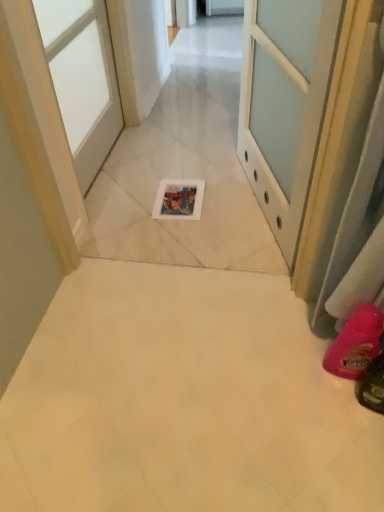
Question: From the image's perspective, is white glossy door at upper center, which appears as the 2th door when viewed from the left, beneath pink rubber boot at lower right?

Choices:
 (A) yes
 (B) no

Answer: (B)

Question: Is the position of white glossy door at upper center, placed as the first door when sorted from right to left, less distant than that of pink rubber boot at lower right?

Choices:
 (A) yes
 (B) no

Answer: (A)

Question: From a real-world perspective, is white glossy door at upper center, placed as the first door when sorted from right to left, located higher than pink rubber boot at lower right?

Choices:
 (A) yes
 (B) no

Answer: (A)

Question: Would you say pink rubber boot at lower right is part of white glossy door at upper center, which appears as the 2th door when viewed from the left,'s contents?

Choices:
 (A) yes
 (B) no

Answer: (B)

Question: Does white glossy door at upper center, which appears as the 2th door when viewed from the left, have a lesser width compared to pink rubber boot at lower right?

Choices:
 (A) yes
 (B) no

Answer: (A)

Question: Is white glossy door at upper center, placed as the first door when sorted from right to left, positioned with its back to pink rubber boot at lower right?

Choices:
 (A) yes
 (B) no

Answer: (B)

Question: Is white glossy door at upper center, which appears as the 2th door when viewed from the left, positioned before white glossy door at upper left, acting as the 1th door starting from the left?

Choices:
 (A) yes
 (B) no

Answer: (A)

Question: Can you confirm if white glossy door at upper center, which appears as the 2th door when viewed from the left, is taller than white glossy door at upper left, the second door from the right?

Choices:
 (A) no
 (B) yes

Answer: (B)

Question: Considering the relative sizes of white glossy door at upper center, placed as the first door when sorted from right to left, and white glossy door at upper left, acting as the 1th door starting from the left, in the image provided, is white glossy door at upper center, placed as the first door when sorted from right to left, thinner than white glossy door at upper left, acting as the 1th door starting from the left,?

Choices:
 (A) no
 (B) yes

Answer: (A)

Question: Is white glossy door at upper center, placed as the first door when sorted from right to left, directly adjacent to white glossy door at upper left, the second door from the right?

Choices:
 (A) no
 (B) yes

Answer: (A)

Question: Considering the relative positions of white glossy door at upper center, placed as the first door when sorted from right to left, and white glossy door at upper left, the second door from the right, in the image provided, is white glossy door at upper center, placed as the first door when sorted from right to left, to the right of white glossy door at upper left, the second door from the right, from the viewer's perspective?

Choices:
 (A) no
 (B) yes

Answer: (B)

Question: From the image's perspective, does white glossy door at upper center, placed as the first door when sorted from right to left, appear lower than white glossy door at upper left, acting as the 1th door starting from the left?

Choices:
 (A) yes
 (B) no

Answer: (A)

Question: Can you confirm if pink rubber boot at lower right is bigger than white glossy door at upper left, the second door from the right?

Choices:
 (A) yes
 (B) no

Answer: (B)